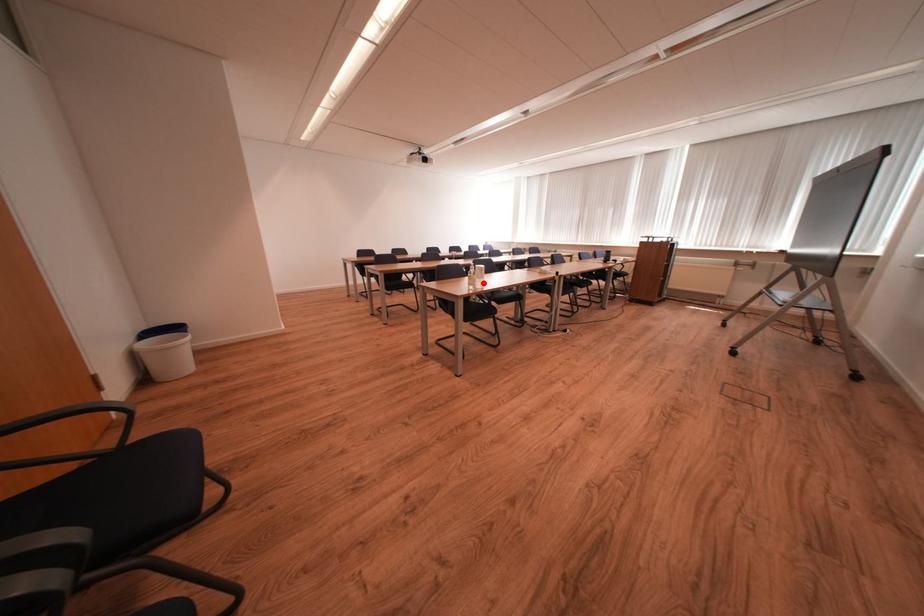
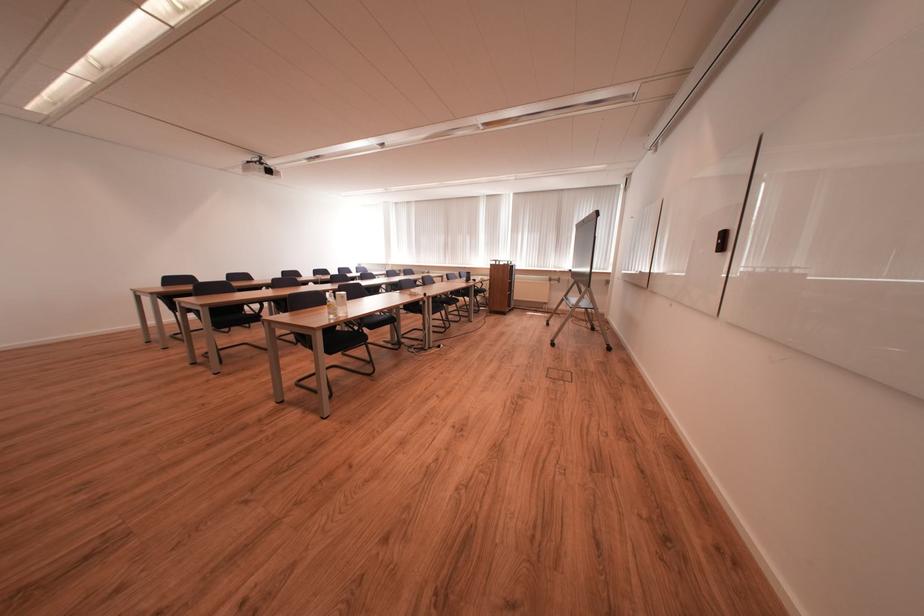
Question: I am providing you with two images of the same scene from different viewpoints. In image1, a red point is highlighted. Considering the same 3D point in image2, which of the following is correct?

Choices:
 (A) It is closer
 (B) It is farther

Answer: (A)